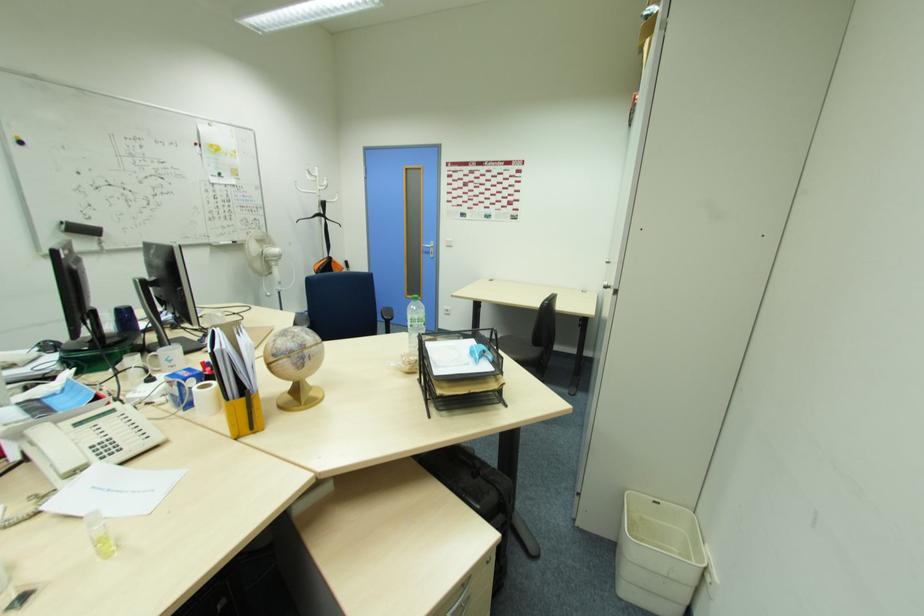
Find the location of a particular element. chair sitting surface is located at coordinates (516, 346).